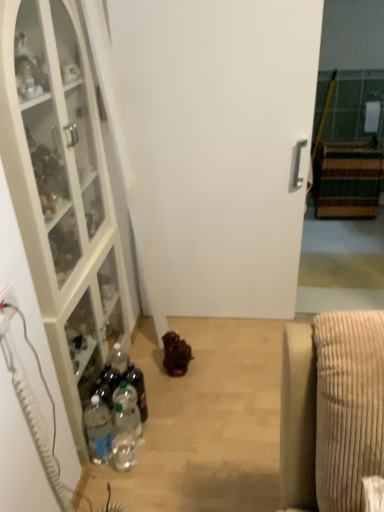
The height and width of the screenshot is (512, 384). What are the coordinates of `free space underneath white matte door at center (from a real-world perspective)` in the screenshot? It's located at (225, 316).